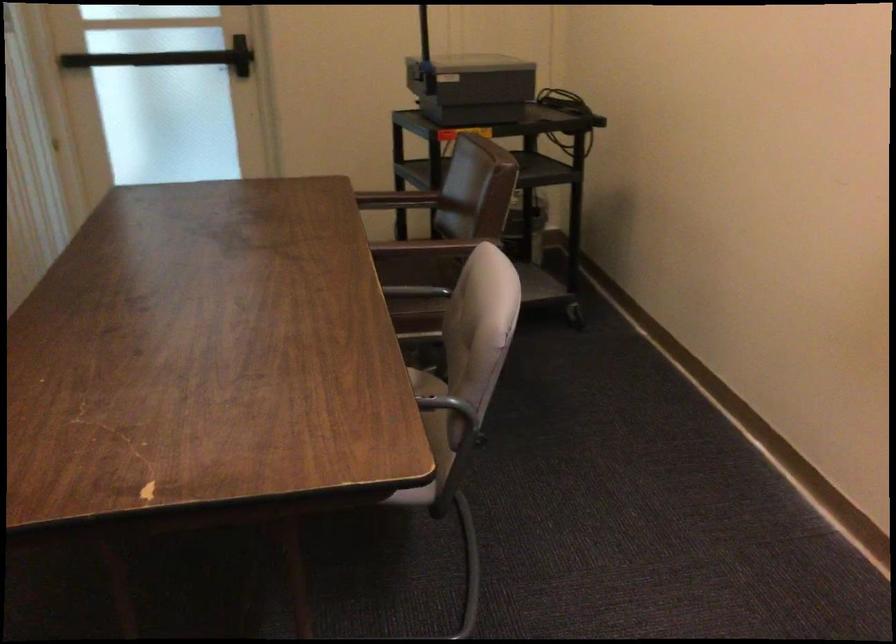
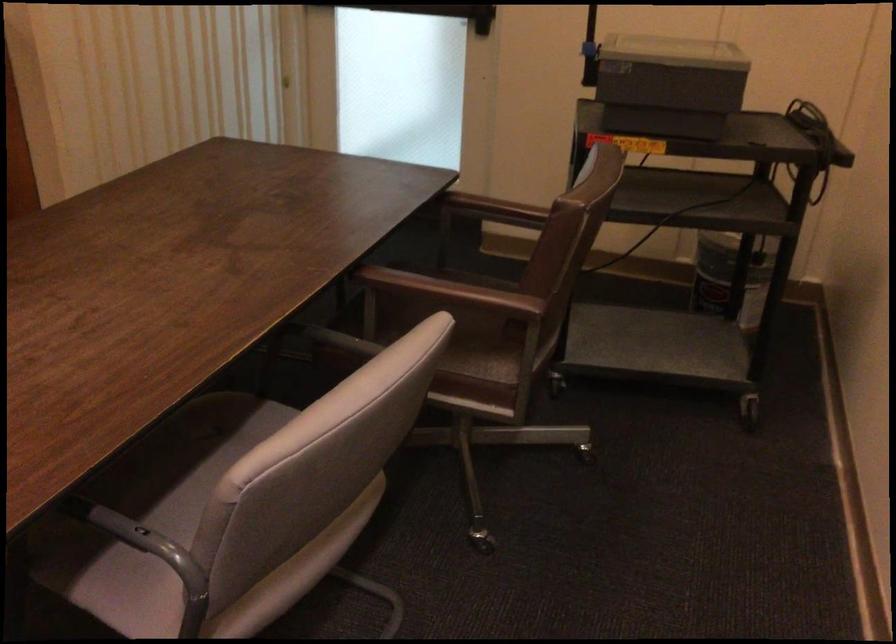
In the second image, find the point that corresponds to point (418, 285) in the first image.

(477, 335)